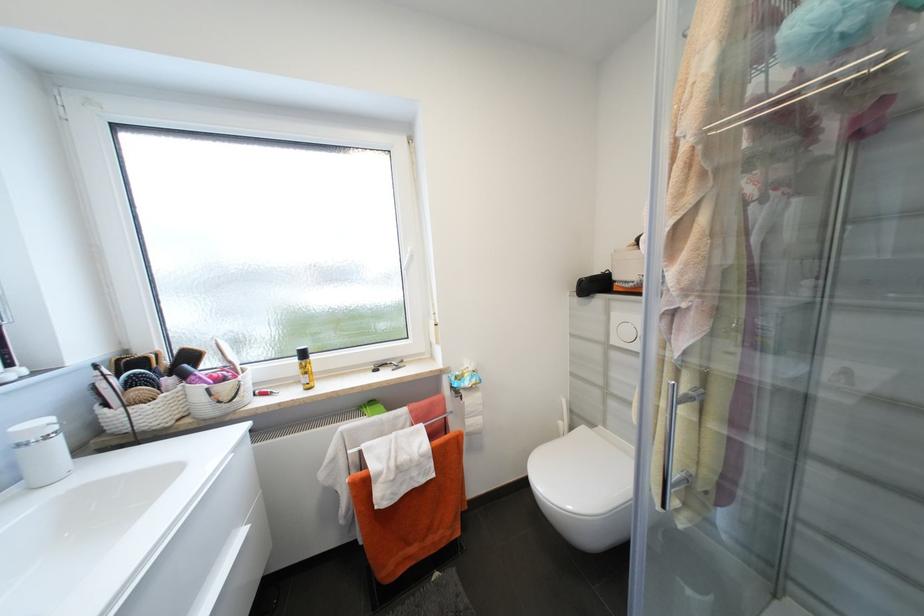
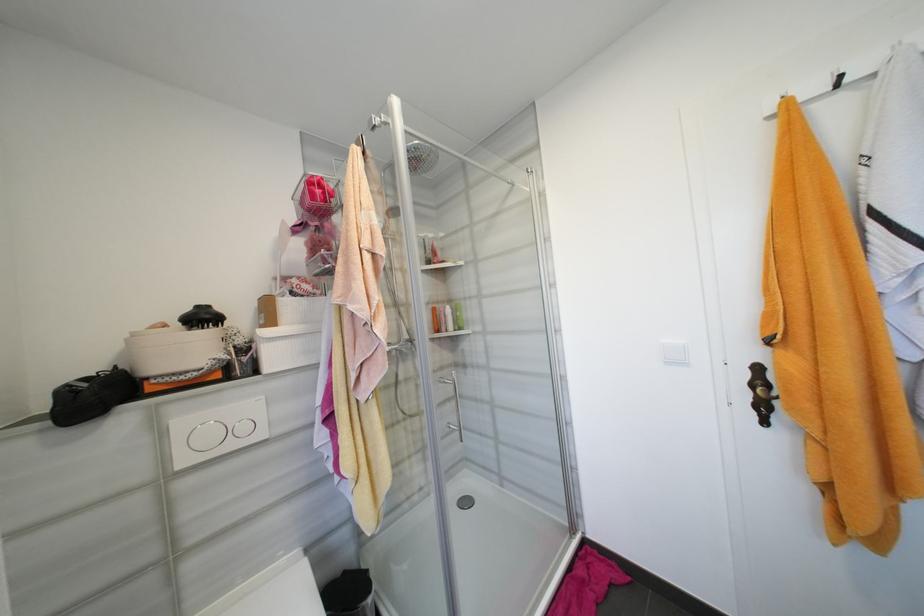
The point at (621,342) is marked in the first image. Where is the corresponding point in the second image?

(189, 463)